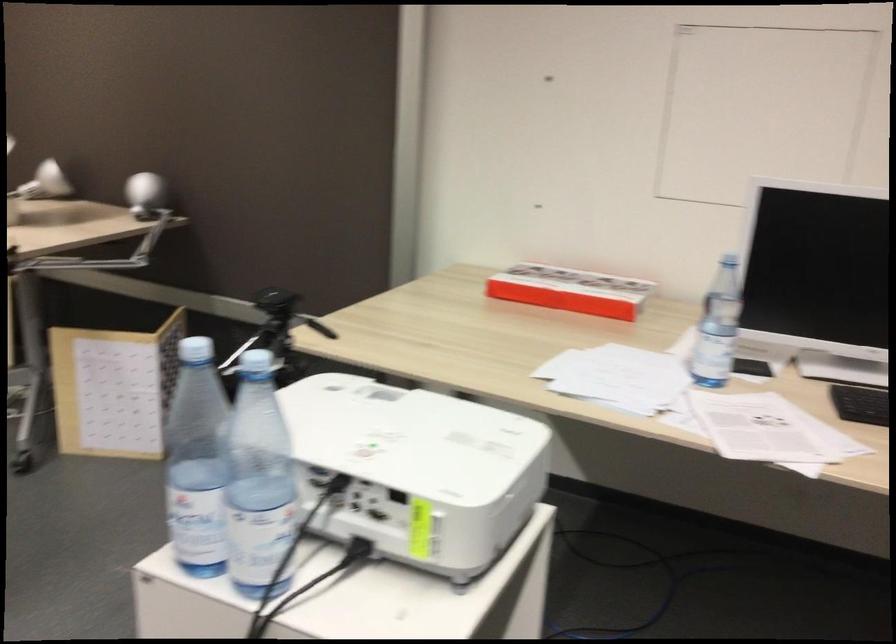
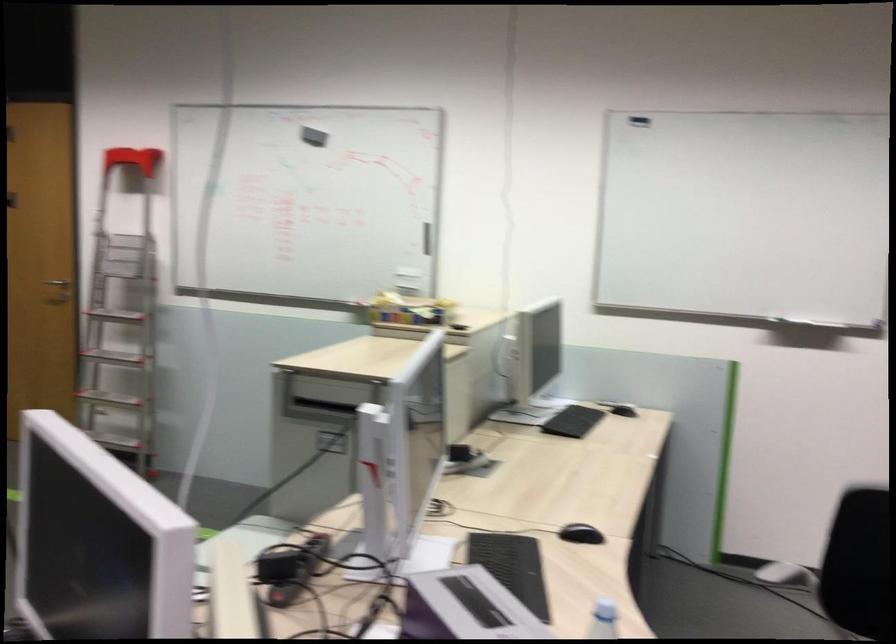
Question: Based on the continuous images, in which direction is the camera rotating? Reply with the corresponding letter.

Choices:
 (A) Left
 (B) Right
 (C) Up
 (D) Down

Answer: (A)